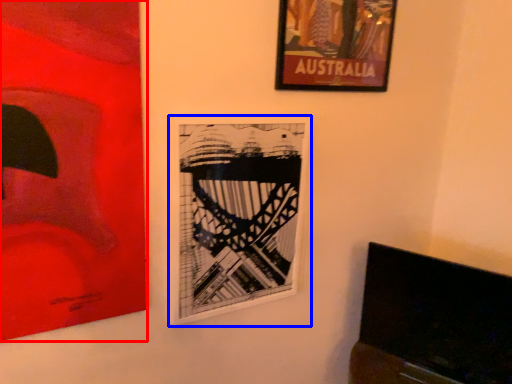
Question: Which point is closer to the camera, picture frame (highlighted by a red box) or picture frame (highlighted by a blue box)?

Choices:
 (A) picture frame
 (B) picture frame

Answer: (A)